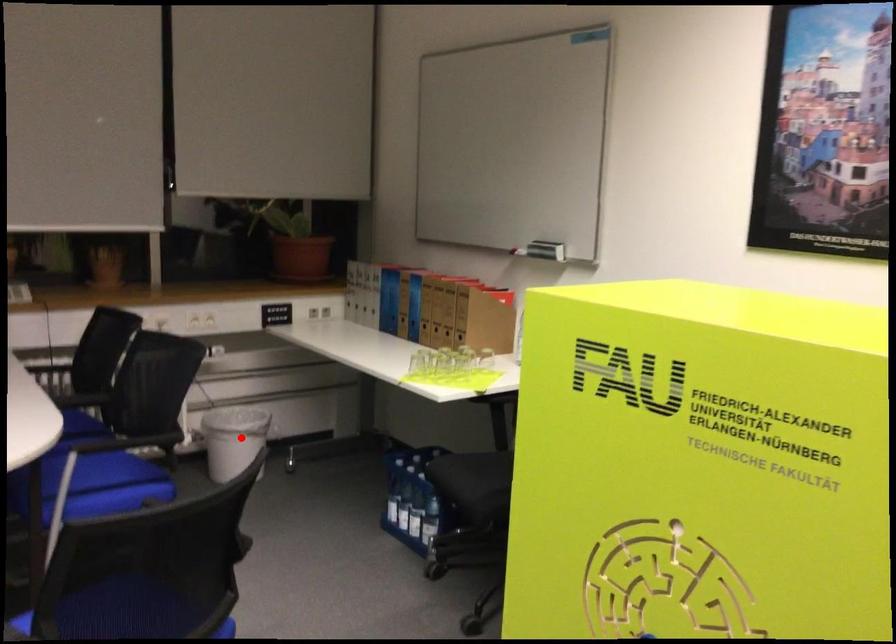
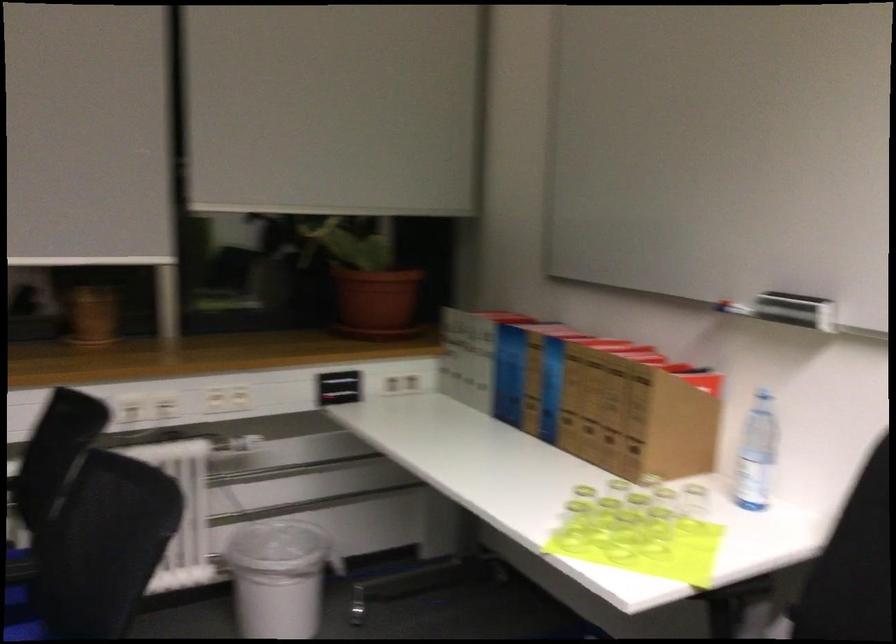
Question: I am providing you with two images of the same scene from different viewpoints. Image1 has a red point marked. In image2, the corresponding 3D location appears at what relative position? Reply with the corresponding letter.

Choices:
 (A) Closer
 (B) Farther

Answer: (A)